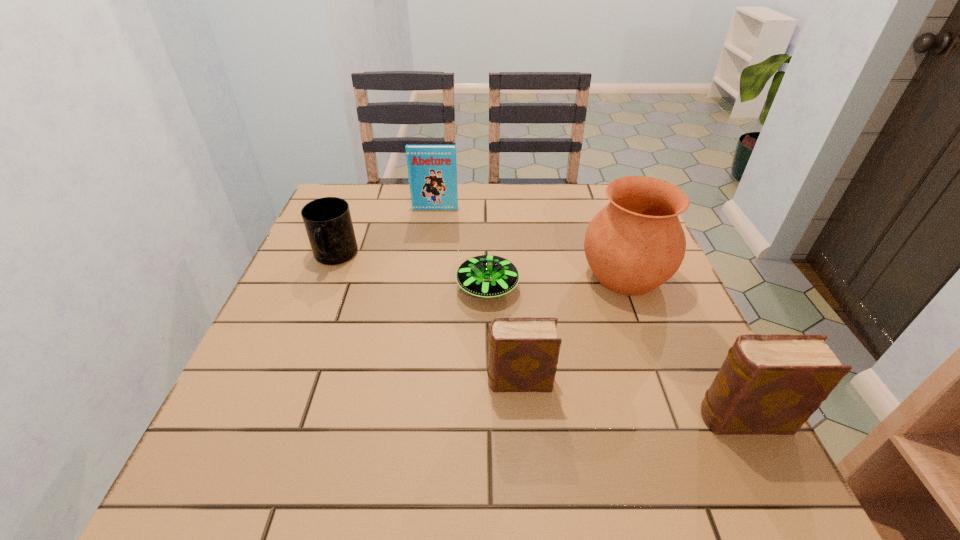
This screenshot has width=960, height=540. Identify the location of object located at the near edge. (768, 384).

Locate an element on the screen. This screenshot has height=540, width=960. object that is at the left edge is located at coordinates (328, 223).

Image resolution: width=960 pixels, height=540 pixels. Find the location of `diary that is at the right edge`. diary that is at the right edge is located at coordinates (768, 384).

I want to click on pottery present at the right edge, so click(x=636, y=243).

Identify the location of object located in the near right corner section of the desktop. The height and width of the screenshot is (540, 960). (768, 384).

I want to click on blank space at the far edge of the desktop, so click(x=504, y=198).

You are a GUI agent. You are given a task and a screenshot of the screen. Output one action in this format:
    pyautogui.click(x=<x>, y=<y>)
    Task: Click on the vacant space at the near edge
    
    Given the screenshot: What is the action you would take?
    pyautogui.click(x=559, y=434)

Identify the location of vacant space at the left edge of the desktop. This screenshot has width=960, height=540. (343, 288).

The height and width of the screenshot is (540, 960). Identify the location of vacant region at the right edge. (663, 377).

This screenshot has width=960, height=540. Find the location of `vacant space at the near right corner`. vacant space at the near right corner is located at coordinates (704, 426).